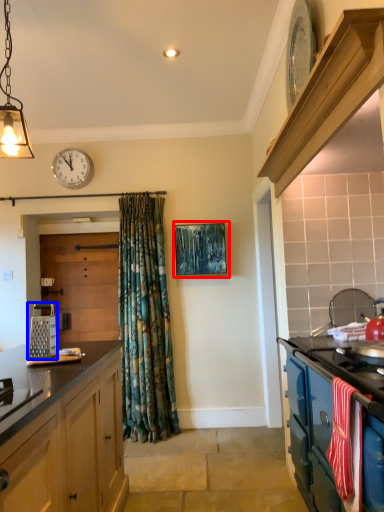
Question: Which object appears farthest to the camera in this image, picture frame (highlighted by a red box) or appliance (highlighted by a blue box)?

Choices:
 (A) picture frame
 (B) appliance

Answer: (A)